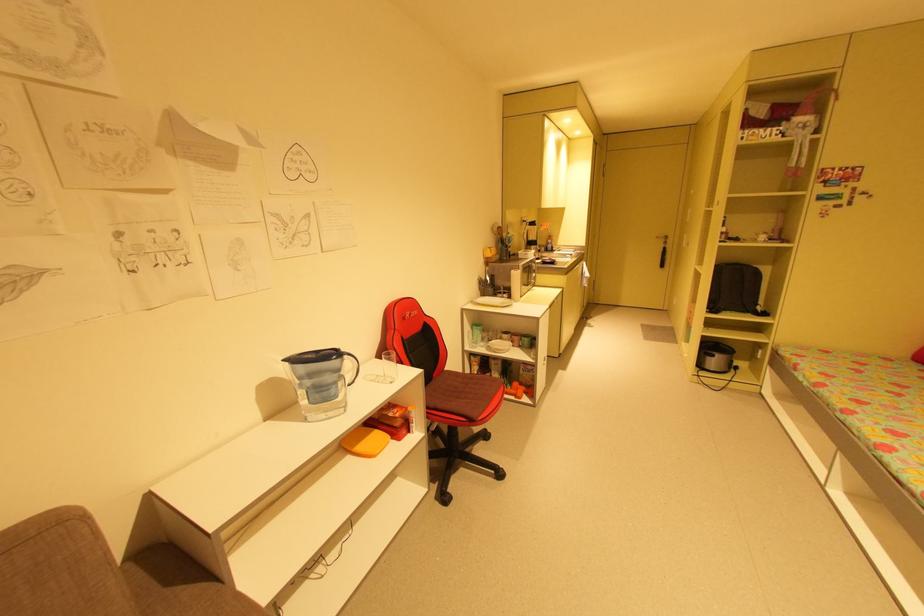
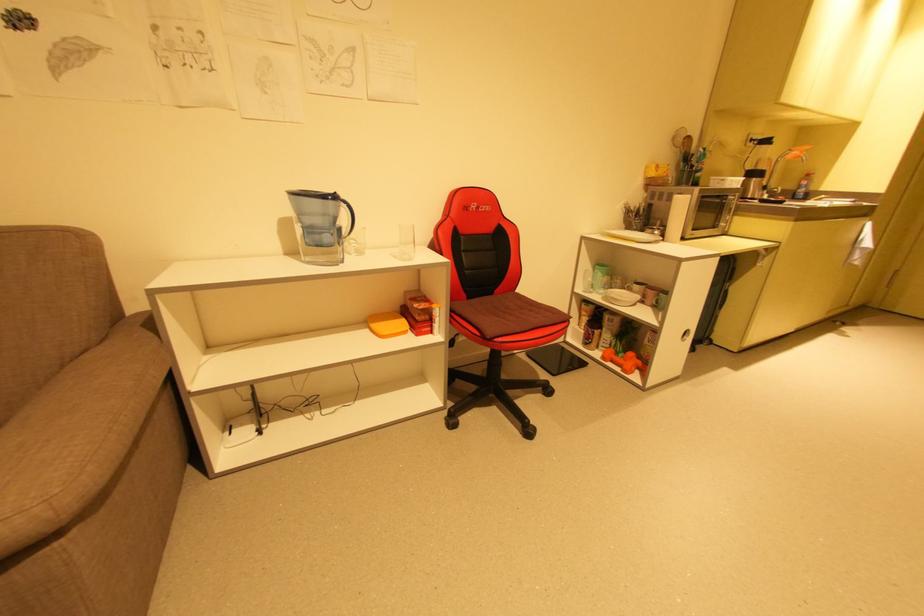
Where in the second image is the point corresponding to point (348, 357) from the first image?

(346, 204)